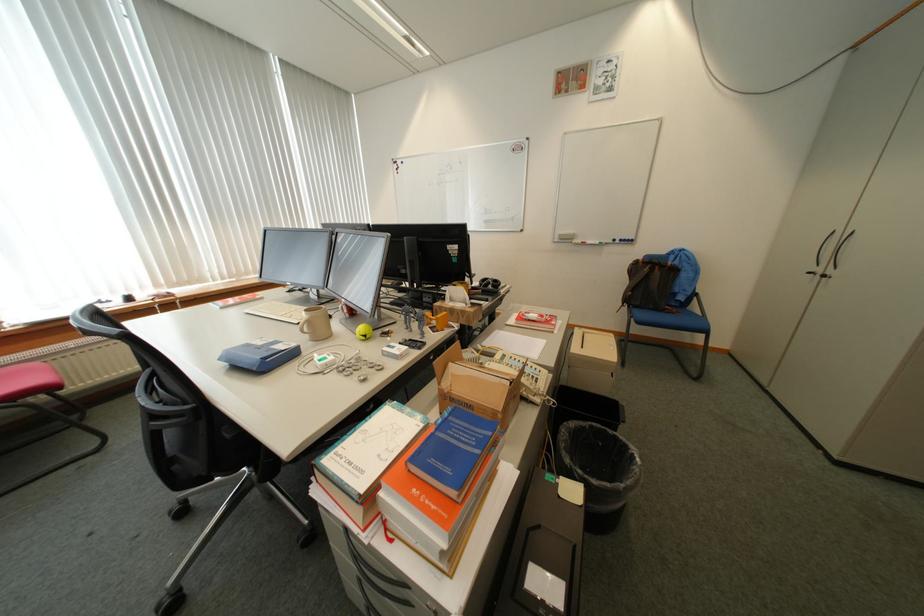
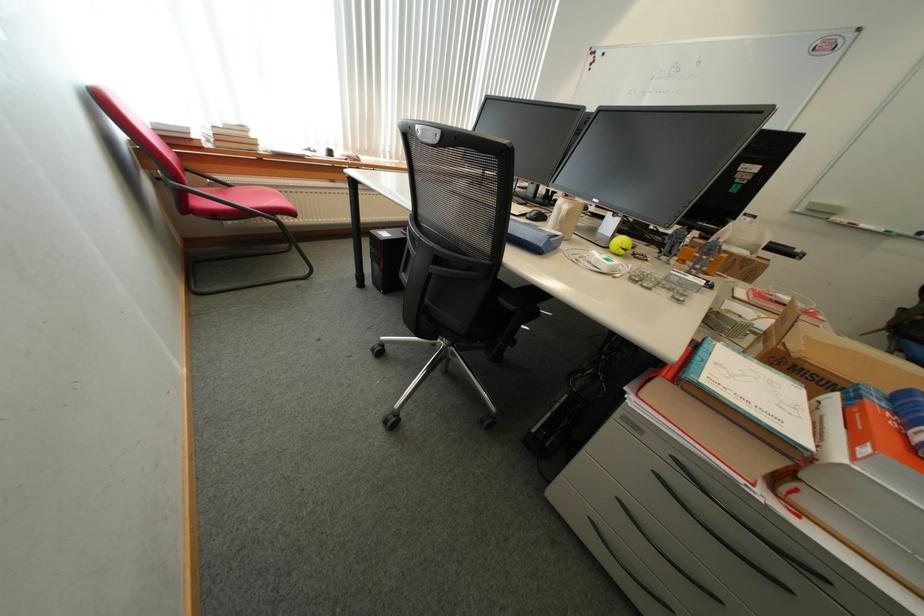
Find the pixel in the second image that matches [311,333] in the first image.

(570, 223)